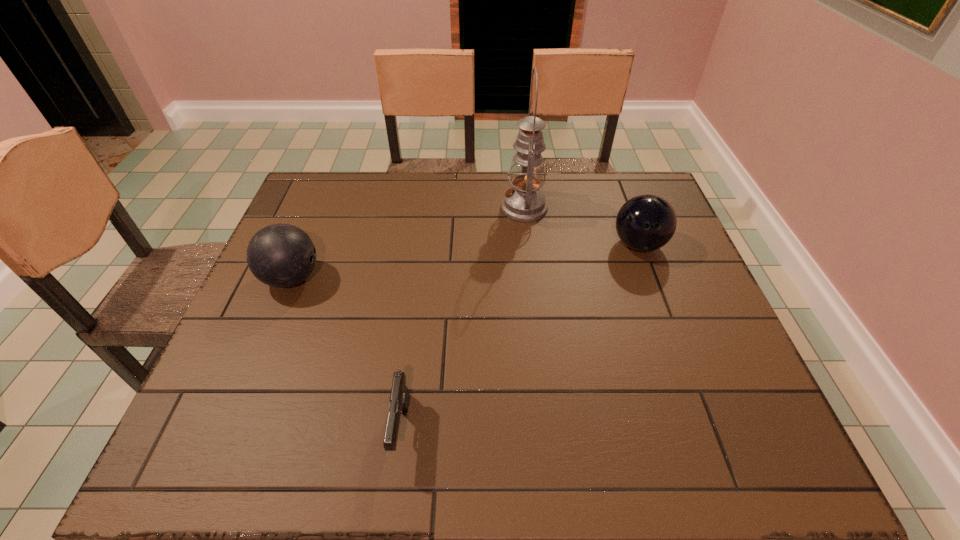
Image resolution: width=960 pixels, height=540 pixels. What are the coordinates of `object identified as the closest to the left bowling ball` in the screenshot? It's located at (399, 397).

Locate which object ranks third in proximity to the rightmost object. Please provide its 2D coordinates. Your answer should be formatted as a tuple, i.e. [(x, y)], where the tuple contains the x and y coordinates of a point satisfying the conditions above.

[(280, 255)]

The height and width of the screenshot is (540, 960). In order to click on vacant area that satisfies the following two spatial constraints: 1. on the side of the right bowling ball with the finger holes; 2. on the grip area of the left bowling ball in this screenshot , I will do `click(651, 278)`.

Locate an element on the screen. vacant space that satisfies the following two spatial constraints: 1. on the side of the right bowling ball with the finger holes; 2. on the grip area of the leftmost object is located at coordinates (651, 278).